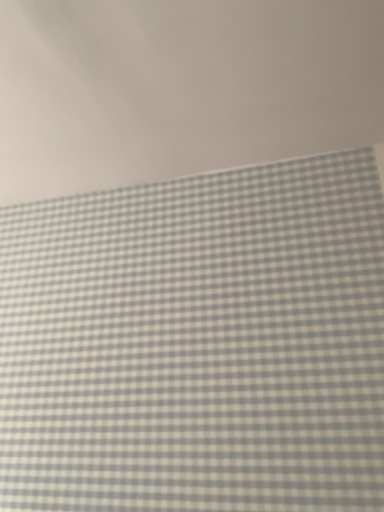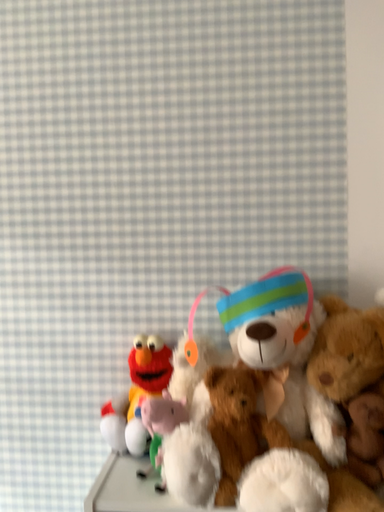
Question: Which way did the camera rotate in the video?

Choices:
 (A) rotated upward
 (B) rotated downward

Answer: (B)